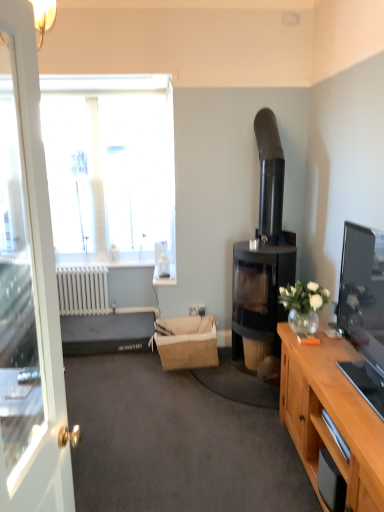
Question: From a real-world perspective, is white plastic power outlet at center located higher than white glossy door at left?

Choices:
 (A) no
 (B) yes

Answer: (A)

Question: Is white plastic power outlet at center closer to camera compared to white glossy door at left?

Choices:
 (A) no
 (B) yes

Answer: (A)

Question: Is white plastic power outlet at center not inside white glossy door at left?

Choices:
 (A) yes
 (B) no

Answer: (A)

Question: Is white glossy door at left at the back of white plastic power outlet at center?

Choices:
 (A) no
 (B) yes

Answer: (A)

Question: From the image's perspective, is white plastic power outlet at center on top of white glossy door at left?

Choices:
 (A) yes
 (B) no

Answer: (B)

Question: Is transparent glass window at upper left in front of or behind dark gray fabric bed at lower left in the image?

Choices:
 (A) behind
 (B) front

Answer: (A)

Question: Choose the correct answer: Is transparent glass window at upper left inside dark gray fabric bed at lower left or outside it?

Choices:
 (A) inside
 (B) outside

Answer: (B)

Question: In terms of width, does transparent glass window at upper left look wider or thinner when compared to dark gray fabric bed at lower left?

Choices:
 (A) wide
 (B) thin

Answer: (B)

Question: Looking at the image, does transparent glass window at upper left seem bigger or smaller compared to dark gray fabric bed at lower left?

Choices:
 (A) big
 (B) small

Answer: (A)

Question: Considering the positions of dark gray fabric bed at lower left and transparent glass window at upper left in the image, is dark gray fabric bed at lower left taller or shorter than transparent glass window at upper left?

Choices:
 (A) short
 (B) tall

Answer: (A)

Question: From the image's perspective, relative to transparent glass window at upper left, is dark gray fabric bed at lower left above or below?

Choices:
 (A) above
 (B) below

Answer: (B)

Question: Would you say dark gray fabric bed at lower left is to the left or to the right of transparent glass window at upper left in the picture?

Choices:
 (A) left
 (B) right

Answer: (B)

Question: Considering the positions of point (125, 332) and point (97, 123), is point (125, 332) closer or farther from the camera than point (97, 123)?

Choices:
 (A) closer
 (B) farther

Answer: (A)

Question: Choose the correct answer: Is white glossy door at left inside transparent glass window at upper left or outside it?

Choices:
 (A) inside
 (B) outside

Answer: (B)

Question: Looking at their shapes, would you say white glossy door at left is wider or thinner than transparent glass window at upper left?

Choices:
 (A) wide
 (B) thin

Answer: (A)